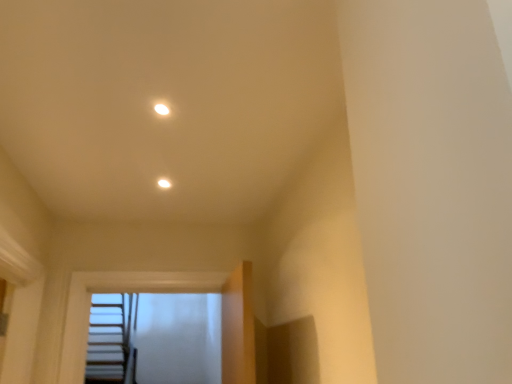
Question: Should I look upward or downward to see white glossy light fixture at upper center?

Choices:
 (A) down
 (B) up

Answer: (B)